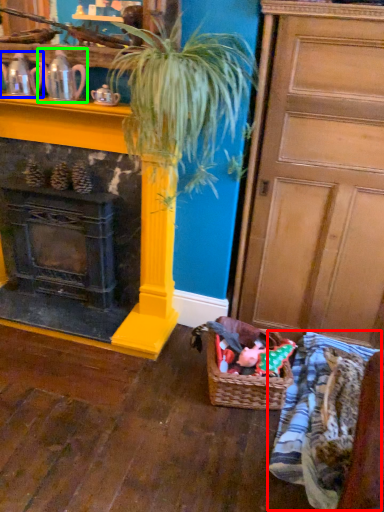
Question: Which is farther away from clothing (highlighted by a red box)? tea pot (highlighted by a blue box) or tea pot (highlighted by a green box)?

Choices:
 (A) tea pot
 (B) tea pot

Answer: (A)